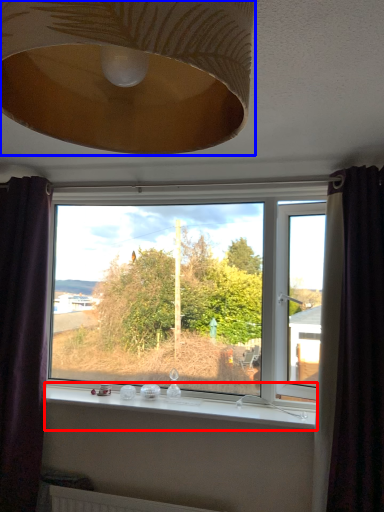
Question: Which point is closer to the camera, window sill (highlighted by a red box) or lamp (highlighted by a blue box)?

Choices:
 (A) window sill
 (B) lamp

Answer: (B)